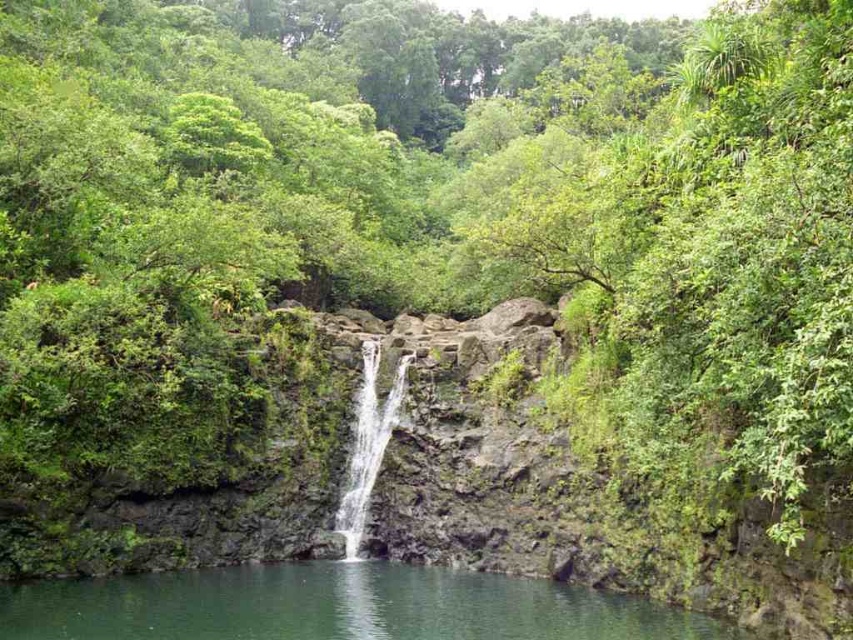
Is point (157, 627) positioned behind point (398, 378)?

No.

Does green smooth water at center have a larger size compared to clear water at center?

Yes.

Find the location of `green smooth water at center`. green smooth water at center is located at coordinates (335, 605).

Where is `green smooth water at center`? Image resolution: width=853 pixels, height=640 pixels. green smooth water at center is located at coordinates (335, 605).